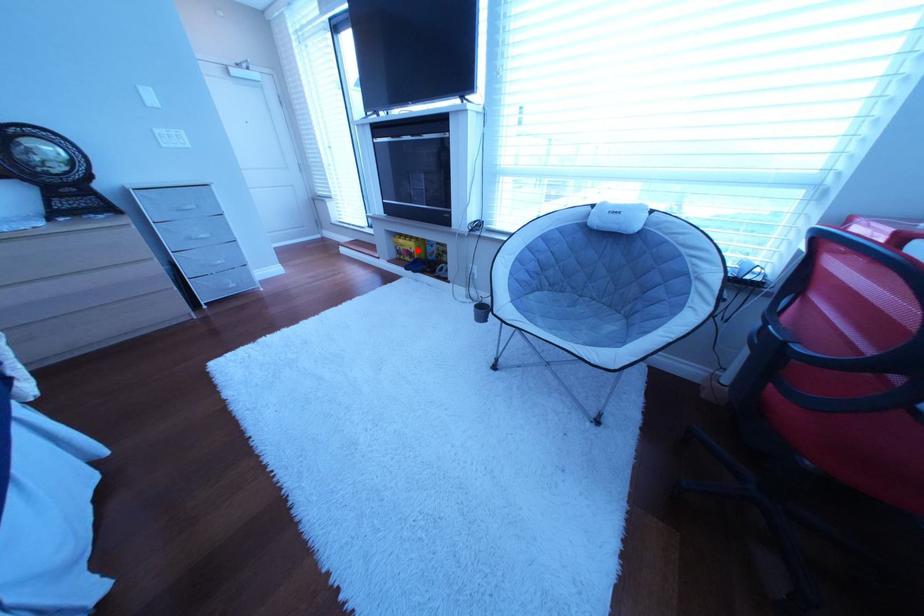
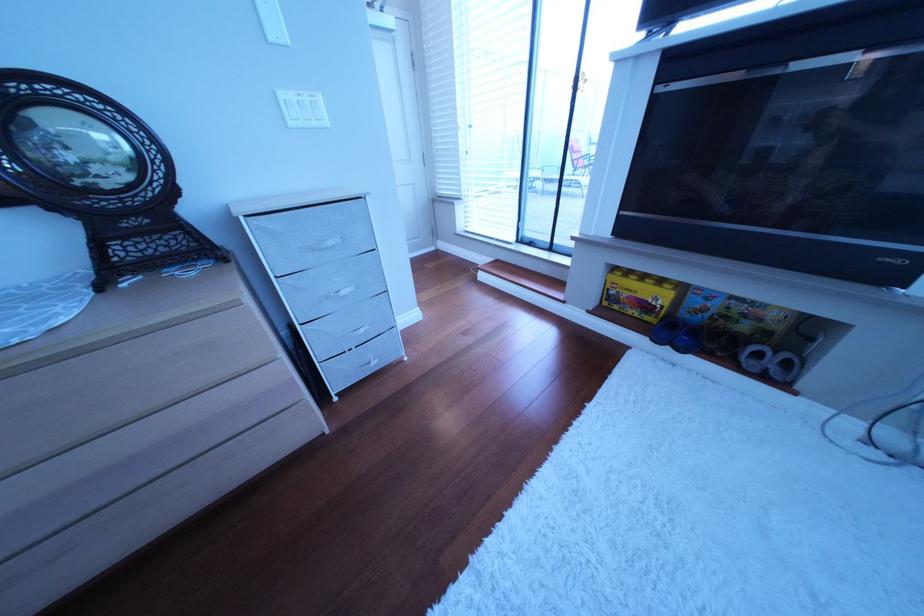
Where in the second image is the point corresponding to the highlighted location from the first image?

(640, 296)